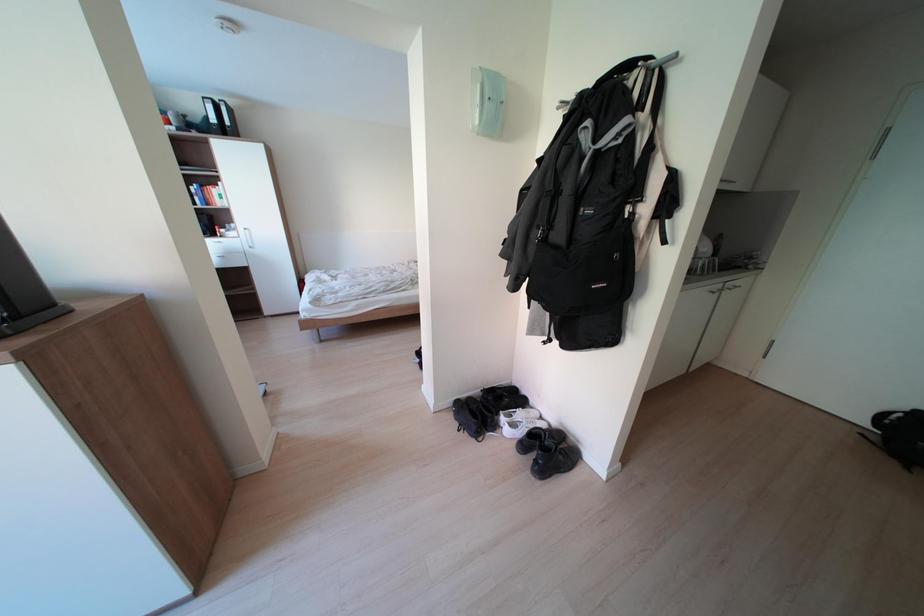
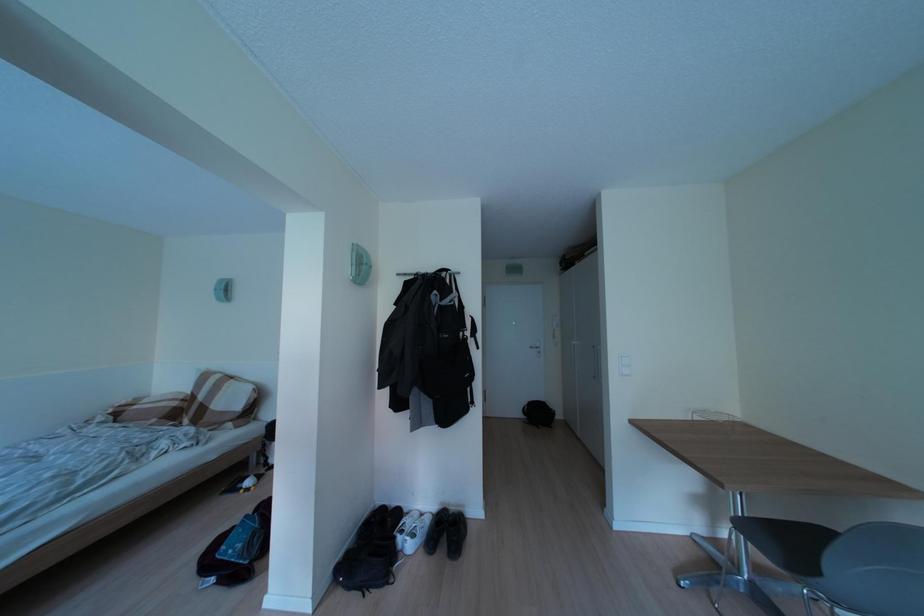
Question: How did the camera likely rotate?

Choices:
 (A) Left
 (B) Right
 (C) Up
 (D) Down

Answer: (B)